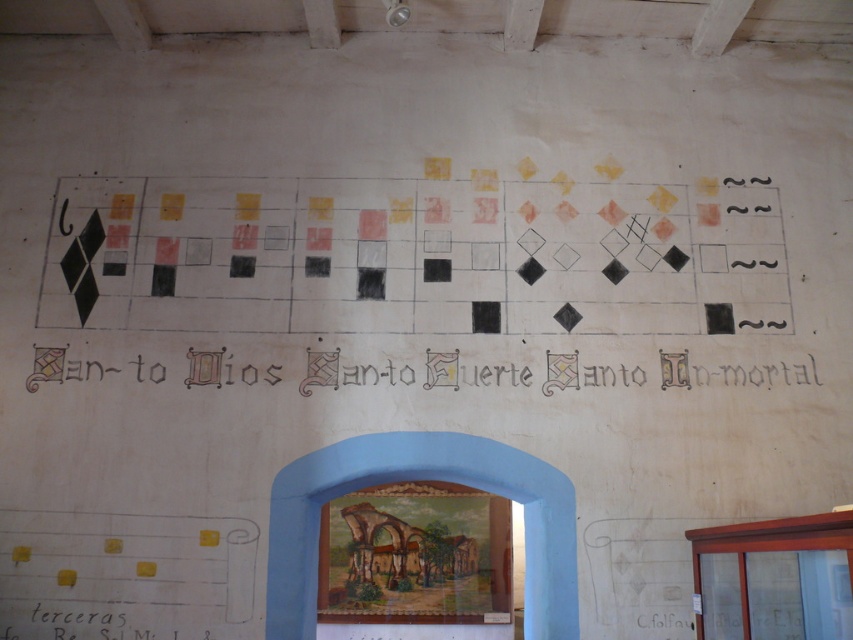
Question: Considering the real-world distances, which object is closest to the black calligraphy at center?

Choices:
 (A) black paper at lower left
 (B) blue painted archway at center

Answer: (B)

Question: Which point is farther to the camera?

Choices:
 (A) black paper at lower left
 (B) black calligraphy at center
 (C) blue painted archway at center

Answer: (B)

Question: Does blue painted archway at center come behind black paper at lower left?

Choices:
 (A) yes
 (B) no

Answer: (A)

Question: Among these objects, which one is nearest to the camera?

Choices:
 (A) black calligraphy at center
 (B) blue painted archway at center

Answer: (B)

Question: Considering the relative positions of black calligraphy at center and black paper at lower left in the image provided, where is black calligraphy at center located with respect to black paper at lower left?

Choices:
 (A) below
 (B) above

Answer: (B)

Question: Is blue painted archway at center smaller than black calligraphy at center?

Choices:
 (A) yes
 (B) no

Answer: (B)